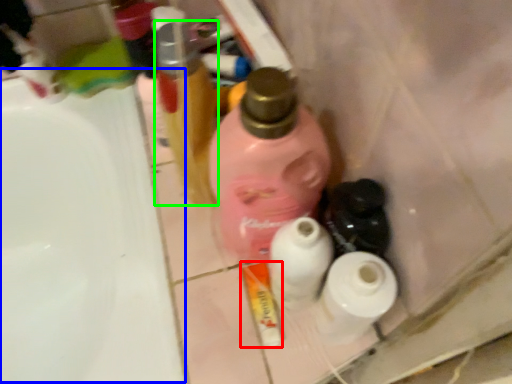
Question: Based on their relative distances, which object is farther from toothpaste (highlighted by a red box)? Choose from sink (highlighted by a blue box) and bottle (highlighted by a green box).

Choices:
 (A) sink
 (B) bottle

Answer: (A)